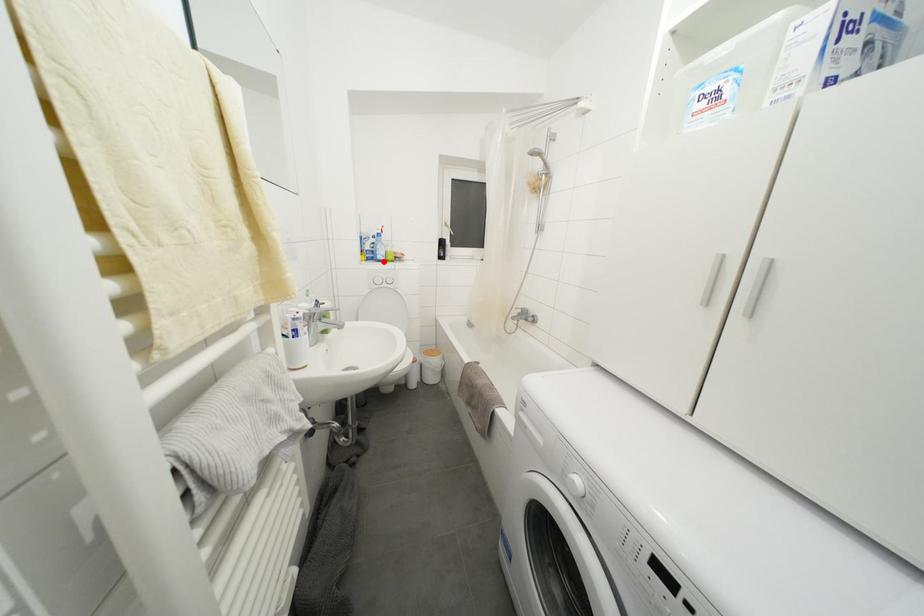
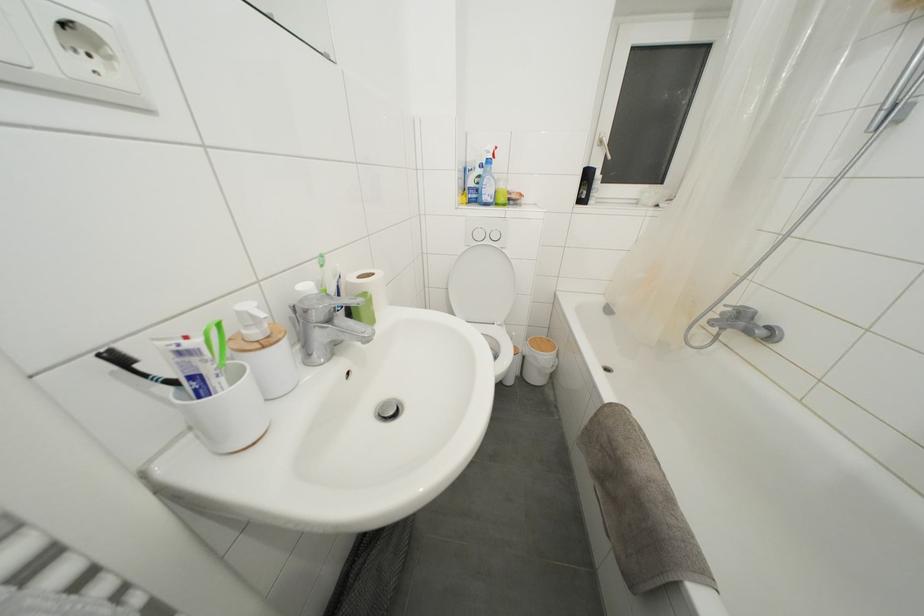
Question: I am providing you with two images of the same scene from different viewpoints. A red point is shown in image1. For the corresponding object point in image2, is it positioned nearer or farther from the camera?

Choices:
 (A) Nearer
 (B) Farther

Answer: (A)